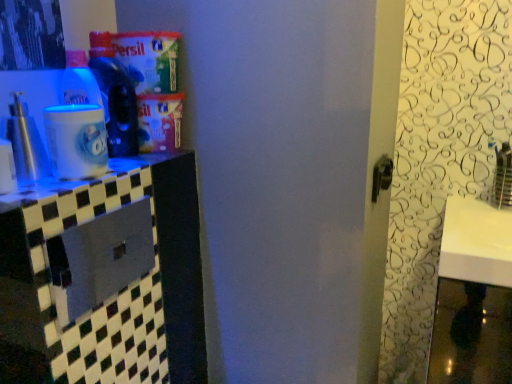
In order to click on vacant space situated above white glossy counter top at left (from a real-world perspective) in this screenshot , I will do `click(88, 175)`.